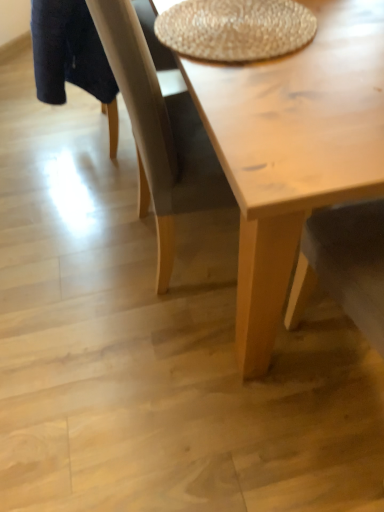
Describe the element at coordinates (293, 150) in the screenshot. I see `light wood table at center` at that location.

At what (x,y) coordinates should I click in order to perform the action: click on light wood table at center. Please return your answer as a coordinate pair (x, y). The width and height of the screenshot is (384, 512). Looking at the image, I should click on (293, 150).

Measure the distance between braided straw placemat at upper center and camera.

braided straw placemat at upper center is 33.46 inches away from camera.

This screenshot has width=384, height=512. I want to click on braided straw placemat at upper center, so click(x=235, y=29).

What do you see at coordinates (235, 29) in the screenshot?
I see `braided straw placemat at upper center` at bounding box center [235, 29].

Locate an element on the screen. light wood table at center is located at coordinates (293, 150).

Between braided straw placemat at upper center and light wood table at center, which one appears on the right side from the viewer's perspective?

braided straw placemat at upper center.

Is braided straw placemat at upper center closer to the viewer compared to light wood table at center?

No, it is not.

Does point (173, 8) come farther from viewer compared to point (341, 54)?

Yes.

From the image's perspective, is braided straw placemat at upper center located beneath light wood table at center?

No, from the image's perspective, braided straw placemat at upper center is not below light wood table at center.

From a real-world perspective, which object stands above the other?

In real-world perspective, braided straw placemat at upper center is above.

Is braided straw placemat at upper center wider than light wood table at center?

No.

Can you confirm if braided straw placemat at upper center is shorter than light wood table at center?

Yes, braided straw placemat at upper center is shorter than light wood table at center.

Considering the sizes of objects braided straw placemat at upper center and light wood table at center in the image provided, who is smaller, braided straw placemat at upper center or light wood table at center?

With smaller size is braided straw placemat at upper center.

Is braided straw placemat at upper center not within light wood table at center?

No, braided straw placemat at upper center is not outside of light wood table at center.

Is braided straw placemat at upper center with light wood table at center?

No, braided straw placemat at upper center is not touching light wood table at center.

Could you tell me if braided straw placemat at upper center is facing light wood table at center?

Yes.

Where is `round table lying behind the light wood table at center`? This screenshot has height=512, width=384. round table lying behind the light wood table at center is located at coordinates (235, 29).

Which is more to the right, light wood table at center or braided straw placemat at upper center?

braided straw placemat at upper center.

Is light wood table at center positioned before braided straw placemat at upper center?

That is True.

Does point (260, 341) lie behind point (264, 20)?

Yes, point (260, 341) is farther from viewer.

From the image's perspective, would you say light wood table at center is shown under braided straw placemat at upper center?

Yes.

From a real-world perspective, is light wood table at center physically located above or below braided straw placemat at upper center?

light wood table at center is below braided straw placemat at upper center.

Which object is wider, light wood table at center or braided straw placemat at upper center?

Wider between the two is light wood table at center.

Which of these two, light wood table at center or braided straw placemat at upper center, stands shorter?

Standing shorter between the two is braided straw placemat at upper center.

Between light wood table at center and braided straw placemat at upper center, which one has larger size?

light wood table at center is bigger.

Would you say light wood table at center is inside or outside braided straw placemat at upper center?

light wood table at center exists outside the volume of braided straw placemat at upper center.

Is light wood table at center far from braided straw placemat at upper center?

No, light wood table at center is not far away from braided straw placemat at upper center.

Is light wood table at center oriented towards braided straw placemat at upper center?

Yes.

Looking at this image, how different are the orientations of light wood table at center and braided straw placemat at upper center in degrees?

The angular difference between light wood table at center and braided straw placemat at upper center is 0.5 degrees.

How far apart are light wood table at center and braided straw placemat at upper center?

light wood table at center is 20.47 centimeters from braided straw placemat at upper center.

Where is `round table that appears behind the light wood table at center`? round table that appears behind the light wood table at center is located at coordinates (235, 29).

The image size is (384, 512). What are the coordinates of `round table on the right of light wood table at center` in the screenshot? It's located at (235, 29).

What are the coordinates of `coffee table below the braided straw placemat at upper center (from a real-world perspective)` in the screenshot? It's located at (293, 150).